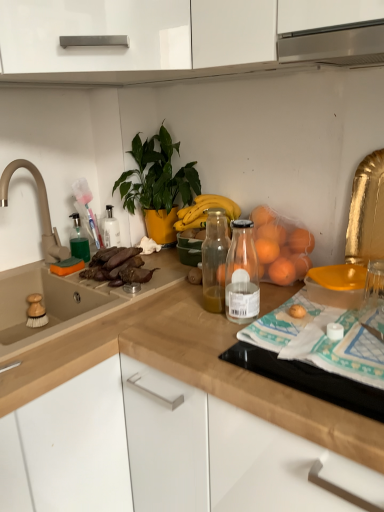
This screenshot has height=512, width=384. What do you see at coordinates (76, 351) in the screenshot?
I see `wooden at left, the 2th countertop ordered from the bottom` at bounding box center [76, 351].

Locate an element on the screen. beige matte faucet at left is located at coordinates (40, 210).

What do you see at coordinates (40, 210) in the screenshot?
I see `beige matte faucet at left` at bounding box center [40, 210].

Locate an element on the screen. The height and width of the screenshot is (512, 384). brown matte sweet potatoes at sink is located at coordinates (117, 267).

Image resolution: width=384 pixels, height=512 pixels. I want to click on wooden at left, the 2th countertop ordered from the bottom, so [x=76, y=351].

Which of these two, green translucent soap dispenser at left or wooden at left, the 2th countertop ordered from the bottom, stands shorter?

green translucent soap dispenser at left is shorter.

What's the angular difference between green translucent soap dispenser at left and wooden at left, the 2th countertop ordered from the bottom,'s facing directions?

The facing directions of green translucent soap dispenser at left and wooden at left, the 2th countertop ordered from the bottom, are 0.0487 degrees apart.

Which point is more forward, (70,237) or (173,296)?

The point (173,296) is closer to the camera.

Consider the image. Does green translucent soap dispenser at left have a lesser width compared to wooden at left, the 2th countertop ordered from the bottom?

Correct, the width of green translucent soap dispenser at left is less than that of wooden at left, the 2th countertop ordered from the bottom.

Which object is further away from the camera taking this photo, wooden at left, the 2th countertop ordered from the bottom, or brown matte sweet potatoes at sink?

brown matte sweet potatoes at sink is more distant.

Does point (31, 391) come in front of point (119, 265)?

Yes, it is.

Between wooden at left, marked as the first countertop in a top-to-bottom arrangement, and brown matte sweet potatoes at sink, which one has smaller width?

brown matte sweet potatoes at sink.

From a real-world perspective, is wooden at left, marked as the first countertop in a top-to-bottom arrangement, positioned above or below brown matte sweet potatoes at sink?

Clearly, from a real-world perspective, wooden at left, marked as the first countertop in a top-to-bottom arrangement, is below brown matte sweet potatoes at sink.

Considering the positions of point (34, 374) and point (80, 246), is point (34, 374) closer or farther from the camera than point (80, 246)?

Clearly, point (34, 374) is closer to the camera than point (80, 246).

From a real-world perspective, is wooden at left, marked as the first countertop in a top-to-bottom arrangement, below green translucent soap dispenser at left?

Correct, in the physical world, wooden at left, marked as the first countertop in a top-to-bottom arrangement, is lower than green translucent soap dispenser at left.

In the scene shown: Can you confirm if wooden at left, marked as the first countertop in a top-to-bottom arrangement, is bigger than green translucent soap dispenser at left?

Yes.

Could you measure the distance between wooden at upper center, which ranks as the second countertop in top-to-bottom order, and brown matte sweet potatoes at sink?

wooden at upper center, which ranks as the second countertop in top-to-bottom order, is 14.78 inches away from brown matte sweet potatoes at sink.

Does wooden at upper center, which is counted as the first countertop, starting from the bottom, have a lesser height compared to brown matte sweet potatoes at sink?

Incorrect, the height of wooden at upper center, which is counted as the first countertop, starting from the bottom, does not fall short of that of brown matte sweet potatoes at sink.

Is point (287, 465) positioned after point (124, 276)?

No, it is not.

Is beige matte faucet at left to the left of wooden at left, marked as the first countertop in a top-to-bottom arrangement, from the viewer's perspective?

Yes, beige matte faucet at left is to the left of wooden at left, marked as the first countertop in a top-to-bottom arrangement.

From a real-world perspective, which object rests below the other?

wooden at left, marked as the first countertop in a top-to-bottom arrangement, is physically lower.

Is wooden at left, marked as the first countertop in a top-to-bottom arrangement, at the back of beige matte faucet at left?

That's not correct — beige matte faucet at left is not looking away from wooden at left, marked as the first countertop in a top-to-bottom arrangement.

Which object is further away from the camera taking this photo, beige matte faucet at left or wooden at left, the 2th countertop ordered from the bottom?

Positioned behind is beige matte faucet at left.

From a real-world perspective, is brown matte sweet potatoes at sink physically located above or below green translucent soap dispenser at left?

Clearly, from a real-world perspective, brown matte sweet potatoes at sink is below green translucent soap dispenser at left.

Looking at their sizes, would you say brown matte sweet potatoes at sink is wider or thinner than green translucent soap dispenser at left?

Considering their sizes, brown matte sweet potatoes at sink looks broader than green translucent soap dispenser at left.

Considering the relative sizes of brown matte sweet potatoes at sink and green translucent soap dispenser at left in the image provided, is brown matte sweet potatoes at sink shorter than green translucent soap dispenser at left?

Yes, brown matte sweet potatoes at sink is shorter than green translucent soap dispenser at left.

Locate an element on the screen. Image resolution: width=384 pixels, height=512 pixels. bottle above the brown matte sweet potatoes at sink (from the image's perspective) is located at coordinates (79, 240).

Which object is positioned more to the left, green glossy plant at upper center or green translucent soap dispenser at left?

Positioned to the left is green translucent soap dispenser at left.

Is green glossy plant at upper center positioned with its back to green translucent soap dispenser at left?

No, green glossy plant at upper center is not facing away from green translucent soap dispenser at left.

Does green glossy plant at upper center have a greater width compared to green translucent soap dispenser at left?

Indeed, green glossy plant at upper center has a greater width compared to green translucent soap dispenser at left.

Is green glossy plant at upper center completely or partially outside of green translucent soap dispenser at left?

Yes, green glossy plant at upper center is outside of green translucent soap dispenser at left.

The height and width of the screenshot is (512, 384). Identify the location of bottle lying on the right of wooden at left, the 2th countertop ordered from the bottom. (79, 240).

Locate an element on the screen. The image size is (384, 512). food above the wooden at left, the 2th countertop ordered from the bottom (from a real-world perspective) is located at coordinates (117, 267).

Looking at the image, which one is located closer to green glossy plant at upper center, green translucent soap dispenser at left or beige matte faucet at left?

green translucent soap dispenser at left is positioned closer to the anchor green glossy plant at upper center.

Looking at the image, which one is located closer to beige matte faucet at left, brown matte sweet potatoes at sink or wooden at upper center, which is counted as the first countertop, starting from the bottom?

Among the two, brown matte sweet potatoes at sink is located nearer to beige matte faucet at left.

Estimate the real-world distances between objects in this image. Which object is further from brown matte sweet potatoes at sink, wooden at upper center, which ranks as the second countertop in top-to-bottom order, or wooden at left, the 2th countertop ordered from the bottom?

wooden at upper center, which ranks as the second countertop in top-to-bottom order.

Considering their positions, is wooden at left, marked as the first countertop in a top-to-bottom arrangement, positioned further to green glossy plant at upper center than brown matte sweet potatoes at sink?

wooden at left, marked as the first countertop in a top-to-bottom arrangement, is positioned further to the anchor green glossy plant at upper center.

Looking at the image, which one is located closer to green translucent soap dispenser at left, wooden at left, marked as the first countertop in a top-to-bottom arrangement, or beige matte faucet at left?

The object closer to green translucent soap dispenser at left is beige matte faucet at left.

From the image, which object appears to be farther from beige matte faucet at left, green glossy plant at upper center or wooden at upper center, which is counted as the first countertop, starting from the bottom?

Among the two, wooden at upper center, which is counted as the first countertop, starting from the bottom, is located further to beige matte faucet at left.

Which object lies nearer to the anchor point brown matte sweet potatoes at sink, green translucent soap dispenser at left or beige matte faucet at left?

green translucent soap dispenser at left lies closer to brown matte sweet potatoes at sink than the other object.

Which object lies further to the anchor point wooden at left, the 2th countertop ordered from the bottom, brown matte sweet potatoes at sink or beige matte faucet at left?

beige matte faucet at left is positioned further to the anchor wooden at left, the 2th countertop ordered from the bottom.

Find the location of a particular element. countertop between wooden at upper center, which is counted as the first countertop, starting from the bottom, and brown matte sweet potatoes at sink in the front-back direction is located at coordinates (76, 351).

Find the location of a particular element. food located between beige matte faucet at left and green translucent soap dispenser at left in the depth direction is located at coordinates (117, 267).

The image size is (384, 512). What are the coordinates of `tap between wooden at upper center, which is counted as the first countertop, starting from the bottom, and brown matte sweet potatoes at sink, along the z-axis` in the screenshot? It's located at (40, 210).

The image size is (384, 512). I want to click on food that lies between green glossy plant at upper center and wooden at left, marked as the first countertop in a top-to-bottom arrangement, from top to bottom, so click(x=117, y=267).